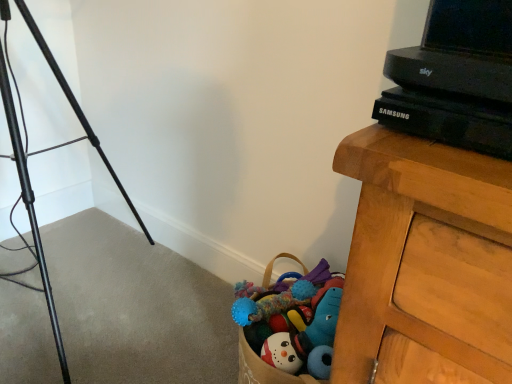
You are a GUI agent. You are given a task and a screenshot of the screen. Output one action in this format:
    pyautogui.click(x=<x>, y=<y>)
    Task: Click on the free spot behind black metal tripod at left
    
    Given the screenshot: What is the action you would take?
    pyautogui.click(x=101, y=245)